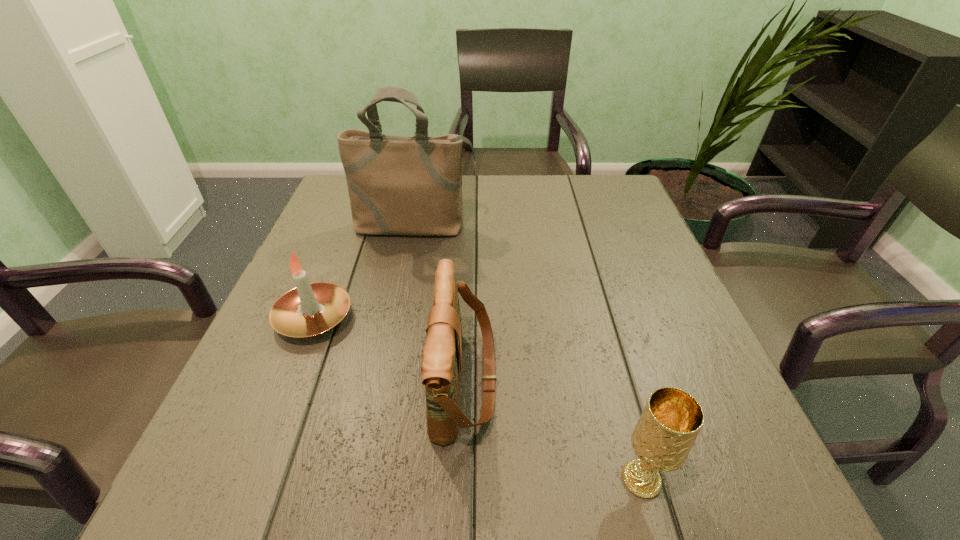
Find the location of a particular element. This screenshot has height=540, width=960. object that is at the far edge is located at coordinates (397, 185).

Locate an element on the screen. The height and width of the screenshot is (540, 960). object that is at the near edge is located at coordinates (662, 439).

Where is `shoulder bag positioned at the left edge`? The height and width of the screenshot is (540, 960). shoulder bag positioned at the left edge is located at coordinates (397, 185).

Where is `candle that is positioned at the left edge`? Image resolution: width=960 pixels, height=540 pixels. candle that is positioned at the left edge is located at coordinates (311, 309).

Identify the location of object located in the right edge section of the desktop. This screenshot has width=960, height=540. (662, 439).

At what (x,y) coordinates should I click in order to perform the action: click on object that is at the far left corner. Please return your answer as a coordinate pair (x, y). Image resolution: width=960 pixels, height=540 pixels. Looking at the image, I should click on (397, 185).

The width and height of the screenshot is (960, 540). Identify the location of object located at the near right corner. click(x=662, y=439).

The image size is (960, 540). Identify the location of free space at the far edge of the desktop. (510, 201).

Identify the location of free space at the near edge of the desktop. The height and width of the screenshot is (540, 960). (524, 477).

In the image, there is a desktop. At what (x,y) coordinates should I click in order to perform the action: click on vacant area at the left edge. Please return your answer as a coordinate pair (x, y). The image size is (960, 540). Looking at the image, I should click on (214, 426).